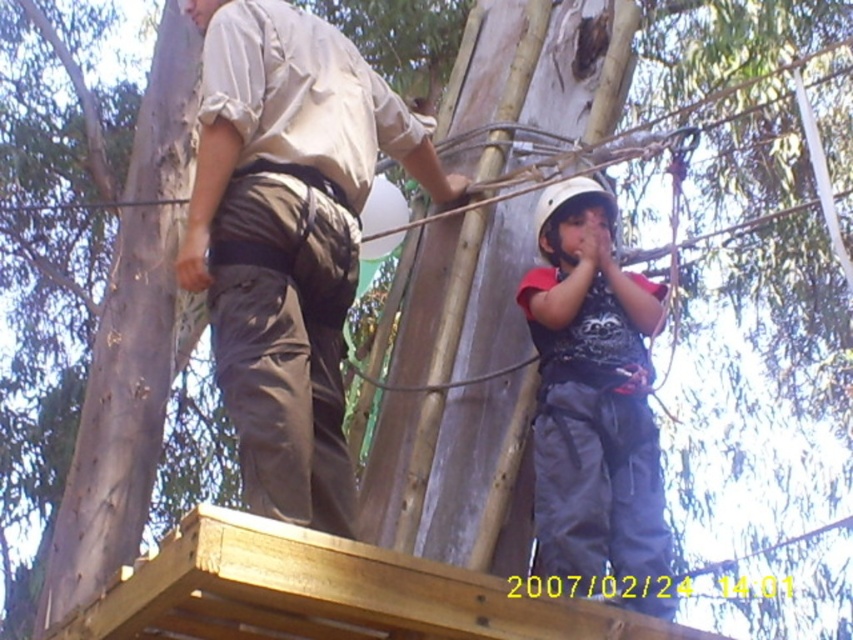
Which of these two, khaki cotton pants at upper center or dark gray fabric pants at center, stands shorter?

With less height is dark gray fabric pants at center.

Which is more to the right, khaki cotton pants at upper center or dark gray fabric pants at center?

dark gray fabric pants at center is more to the right.

Is point (242, 333) less distant than point (546, 371)?

That is True.

At what (x,y) coordinates should I click in order to perform the action: click on khaki cotton pants at upper center. Please return your answer as a coordinate pair (x, y). This screenshot has height=640, width=853. Looking at the image, I should click on (288, 237).